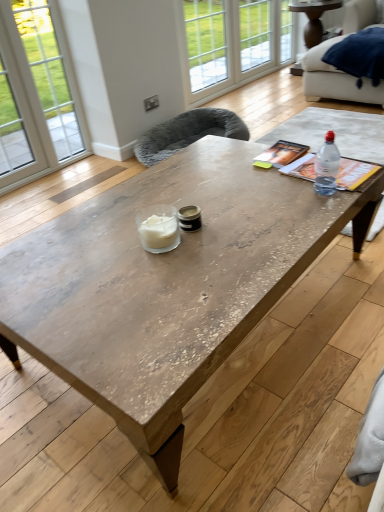
Locate an element on the screen. The image size is (384, 512). vacant space situated on the left part of clear plastic bottle at upper right is located at coordinates (274, 197).